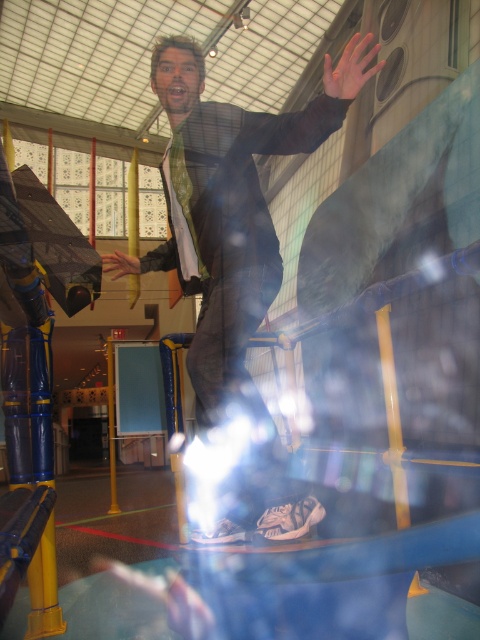
You are a safety inspector checking the playground equipment. You notice two hands touching different parts of the structure. The orange matte hand at upper center is on a climbing bar, and the matte black hand at center is on a platform. Based on their positions, which hand is higher up?

The orange matte hand at upper center is higher up since it is positioned above the matte black hand at center.

You are a safety inspector checking the playground. You notice the shiny black suit at center and the orange matte hand at upper center. Which object is bigger in size?

The shiny black suit at center is larger in size compared to the orange matte hand at upper center.